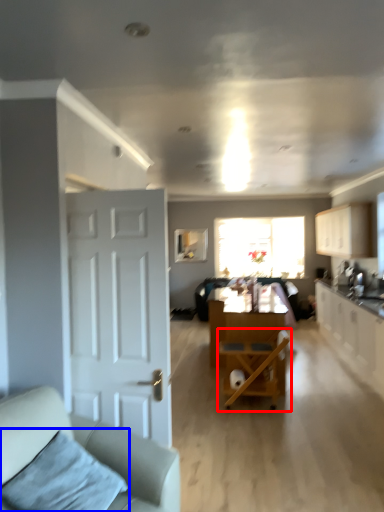
Question: Among these objects, which one is nearest to the camera, chair (highlighted by a red box) or pillow (highlighted by a blue box)?

Choices:
 (A) chair
 (B) pillow

Answer: (B)